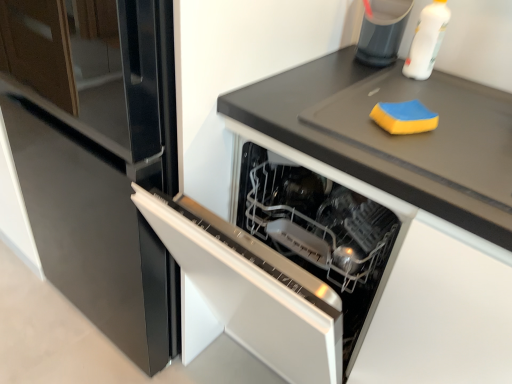
Question: Does black matte countertop at upper right have a lesser height compared to sleek stainless steel dishwasher at center?

Choices:
 (A) yes
 (B) no

Answer: (A)

Question: Is black matte countertop at upper right bigger than sleek stainless steel dishwasher at center?

Choices:
 (A) no
 (B) yes

Answer: (A)

Question: Is black matte countertop at upper right taller than sleek stainless steel dishwasher at center?

Choices:
 (A) yes
 (B) no

Answer: (B)

Question: Does black matte countertop at upper right have a lesser width compared to sleek stainless steel dishwasher at center?

Choices:
 (A) yes
 (B) no

Answer: (A)

Question: Does black matte countertop at upper right have a smaller size compared to sleek stainless steel dishwasher at center?

Choices:
 (A) yes
 (B) no

Answer: (A)

Question: Does black matte countertop at upper right have a greater width compared to sleek stainless steel dishwasher at center?

Choices:
 (A) no
 (B) yes

Answer: (A)

Question: Can you confirm if yellow sponge at upper right is thinner than black matte countertop at upper right?

Choices:
 (A) no
 (B) yes

Answer: (B)

Question: From a real-world perspective, is yellow sponge at upper right on top of black matte countertop at upper right?

Choices:
 (A) no
 (B) yes

Answer: (B)

Question: Is yellow sponge at upper right positioned before black matte countertop at upper right?

Choices:
 (A) yes
 (B) no

Answer: (B)

Question: Is yellow sponge at upper right to the right of black matte countertop at upper right from the viewer's perspective?

Choices:
 (A) no
 (B) yes

Answer: (A)

Question: Can black matte countertop at upper right be found inside yellow sponge at upper right?

Choices:
 (A) no
 (B) yes

Answer: (A)

Question: Does yellow sponge at upper right appear on the left side of black matte countertop at upper right?

Choices:
 (A) yes
 (B) no

Answer: (A)

Question: Does white plastic bottle at upper right come behind yellow sponge at upper right?

Choices:
 (A) yes
 (B) no

Answer: (A)